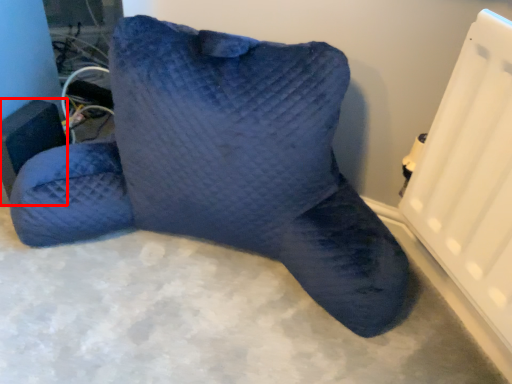
Question: Considering the relative positions of speaker (annotated by the red box) and furniture in the image provided, where is speaker (annotated by the red box) located with respect to the staircase?

Choices:
 (A) right
 (B) left

Answer: (B)